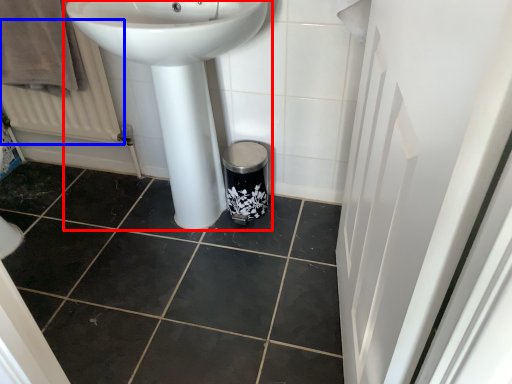
Question: Which object is closer to the camera taking this photo, sink (highlighted by a red box) or radiator (highlighted by a blue box)?

Choices:
 (A) sink
 (B) radiator

Answer: (A)